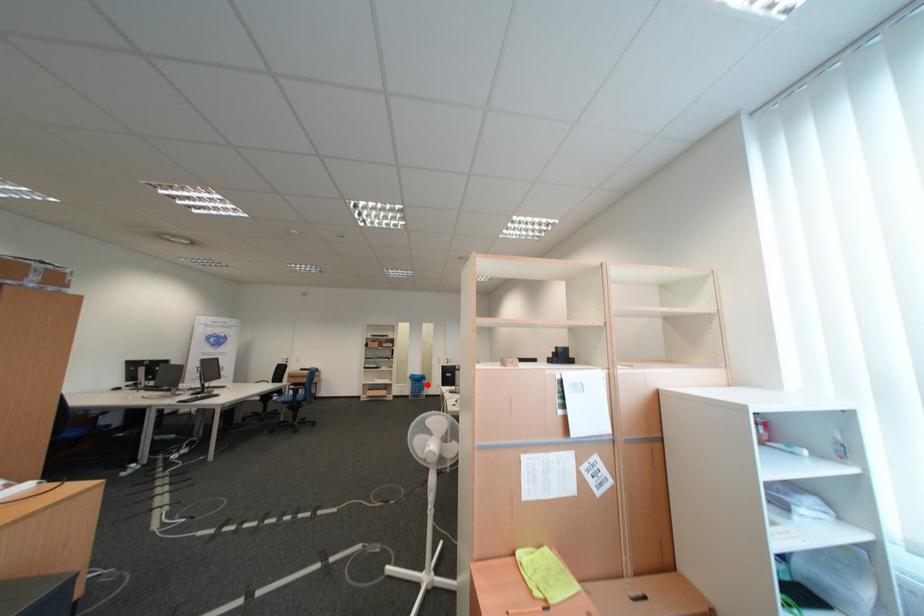
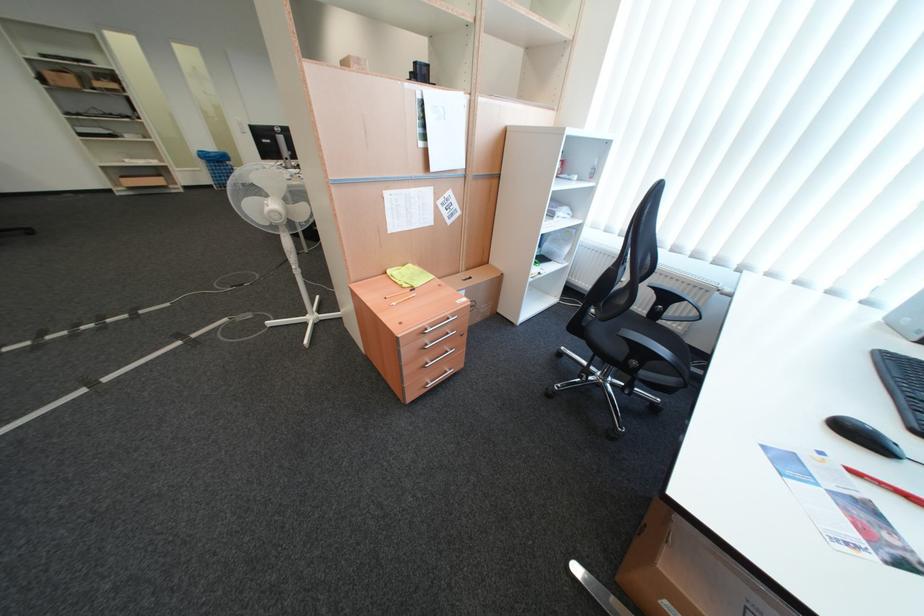
Where in the second image is the point corresponding to the highlighted location from the first image?

(227, 168)